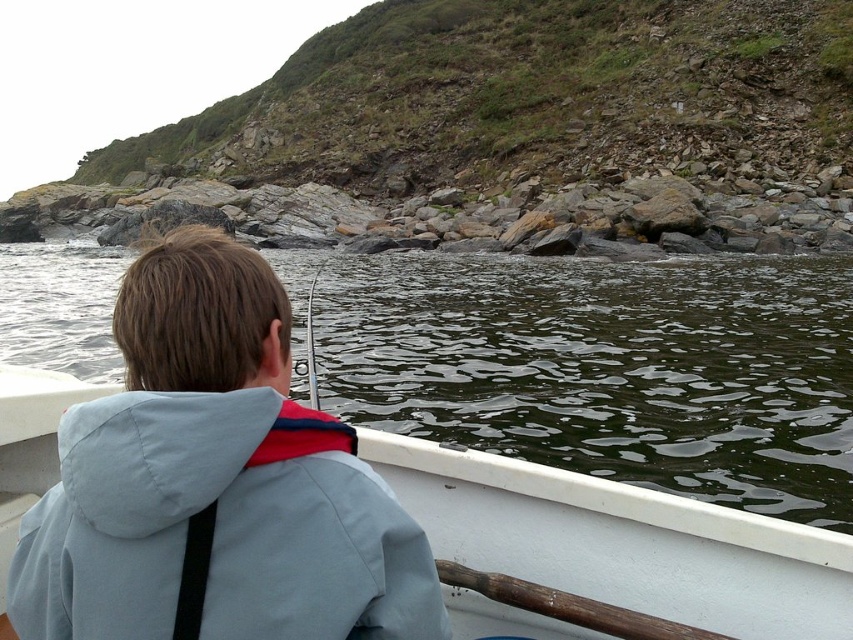
Who is more forward, (x=331, y=308) or (x=235, y=554)?

Point (x=235, y=554)

Can you confirm if greenish water at center is bigger than light blue fabric jacket at upper left?

Yes, greenish water at center is bigger than light blue fabric jacket at upper left.

You are a GUI agent. You are given a task and a screenshot of the screen. Output one action in this format:
    pyautogui.click(x=<x>, y=<y>)
    Task: Click on the greenish water at center
    
    Given the screenshot: What is the action you would take?
    pyautogui.click(x=608, y=368)

In the scene shown: Is light blue fabric jacket at upper left to the right of white matte canoe at center from the viewer's perspective?

No, light blue fabric jacket at upper left is not to the right of white matte canoe at center.

Between point (389, 493) and point (741, 584), which one is positioned in front?

Positioned in front is point (389, 493).

Locate an element on the screen. light blue fabric jacket at upper left is located at coordinates (218, 529).

Consider the image. Is rockymaterial/texture at upper center positioned in front of white matte canoe at center?

No, rockymaterial/texture at upper center is further to the viewer.

Who is more distant from viewer, [212,188] or [851,636]?

The point [212,188] is behind.

Does point (686, 182) come behind point (445, 531)?

Yes, it is.

Locate an element on the screen. The image size is (853, 640). rockymaterial/texture at upper center is located at coordinates (512, 128).